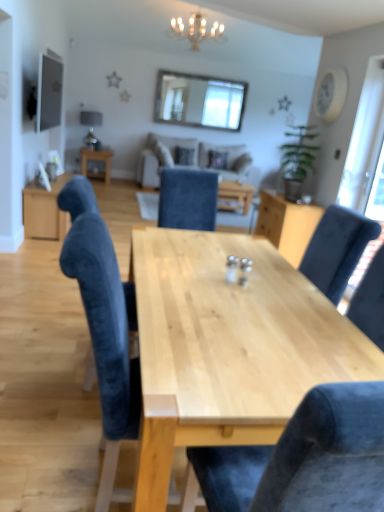
Question: From a real-world perspective, relative to beige fabric couch at center, is clear glass window at upper center, acting as the 1th window screen starting from the top, vertically above or below?

Choices:
 (A) above
 (B) below

Answer: (A)

Question: In terms of width, does clear glass window at upper center, the first window screen when ordered from back to front, look wider or thinner when compared to beige fabric couch at center?

Choices:
 (A) wide
 (B) thin

Answer: (B)

Question: Estimate the real-world distances between objects in this image. Which object is farther from the clear glass window at upper center, the first window screen when ordered from back to front?

Choices:
 (A) wooden table at center, marked as the second table in a right-to-left arrangement
 (B) natural wood table at center, the first table positioned from the bottom
 (C) beige fabric couch at center
 (D) light wood cabinet at center
 (E) transparent glass door at right, placed as the first window screen when sorted from bottom to top

Answer: (B)

Question: Estimate the real-world distances between objects in this image. Which object is farther from the transparent glass door at right, placed as the first window screen when sorted from bottom to top?

Choices:
 (A) beige fabric couch at center
 (B) light wood cabinet at center
 (C) velvet blue chair at center, acting as the 2th chair starting from the front
 (D) natural wood table at center, which is the first table from right to left
 (E) velvet blue chair at center, the second chair when ordered from back to front

Answer: (E)